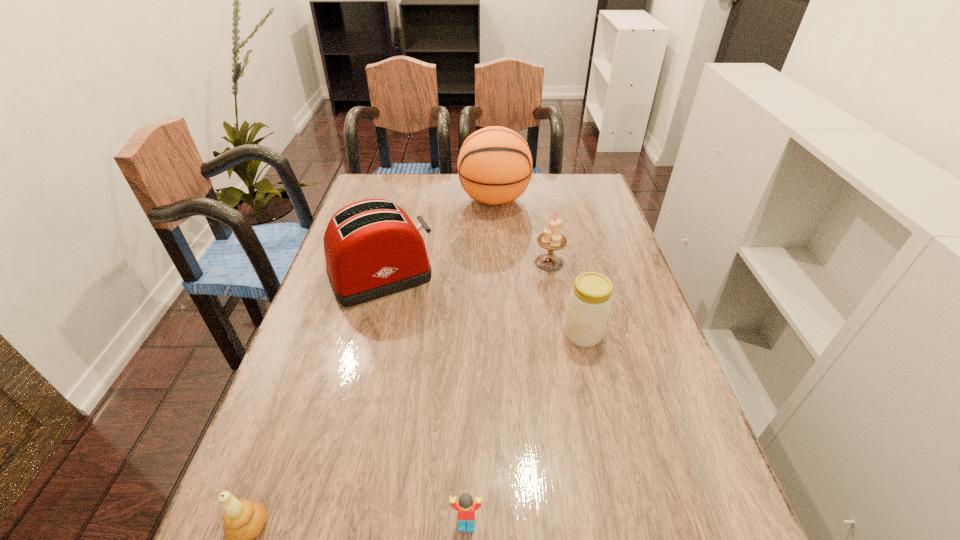
This screenshot has height=540, width=960. Find the location of `free space between the basketball and the farther candle_holder`. free space between the basketball and the farther candle_holder is located at coordinates (521, 231).

Where is `free point between the Lego and the basketball`? free point between the Lego and the basketball is located at coordinates (480, 362).

Image resolution: width=960 pixels, height=540 pixels. What are the coordinates of `free area in between the basketball and the fifth shortest object` in the screenshot? It's located at (438, 238).

You are a GUI agent. You are given a task and a screenshot of the screen. Output one action in this format:
    pyautogui.click(x=<x>, y=<y>)
    Task: Click on the free point between the right candle_holder and the basketball
    
    Given the screenshot: What is the action you would take?
    pyautogui.click(x=521, y=231)

Identify the location of object identified as the fourth closest to the tallest object. (466, 508).

What are the coordinates of `object identified as the fifth closest to the taller candle_holder` in the screenshot? It's located at (243, 519).

The image size is (960, 540). What are the coordinates of `vacant space that satisfies the following two spatial constraints: 1. on the front side of the third nearest object; 2. on the right side of the fifth shortest object` in the screenshot? It's located at (366, 334).